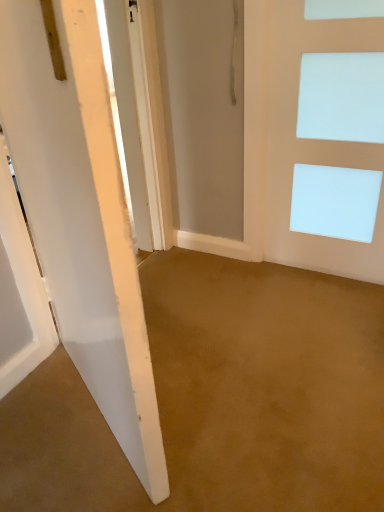
Question: From a real-world perspective, is white matte door at center, the 1th door from the left, located higher than white matte door at right, the second door viewed from the left?

Choices:
 (A) yes
 (B) no

Answer: (A)

Question: Is white matte door at center, the 1th door from the left, next to white matte door at right, the second door viewed from the left, and touching it?

Choices:
 (A) no
 (B) yes

Answer: (A)

Question: Is white matte door at center, the second door when ordered from right to left, smaller than white matte door at right, which is the 1th door from right to left?

Choices:
 (A) yes
 (B) no

Answer: (B)

Question: Is white matte door at center, the second door when ordered from right to left, oriented towards white matte door at right, which is the 1th door from right to left?

Choices:
 (A) yes
 (B) no

Answer: (A)

Question: Is white matte door at center, the 1th door from the left, positioned in front of white matte door at right, which is the 1th door from right to left?

Choices:
 (A) no
 (B) yes

Answer: (B)

Question: Can you confirm if white matte door at center, the second door when ordered from right to left, is thinner than white matte door at right, which is the 1th door from right to left?

Choices:
 (A) no
 (B) yes

Answer: (A)

Question: Is white matte door at right, which is the 1th door from right to left, thinner than white matte door at center, the second door when ordered from right to left?

Choices:
 (A) yes
 (B) no

Answer: (A)

Question: Would you consider white matte door at right, the second door viewed from the left, to be distant from white matte door at center, the 1th door from the left?

Choices:
 (A) yes
 (B) no

Answer: (A)

Question: Does white matte door at right, which is the 1th door from right to left, have a larger size compared to white matte door at center, the 1th door from the left?

Choices:
 (A) no
 (B) yes

Answer: (A)

Question: From the image's perspective, is white matte door at right, which is the 1th door from right to left, on white matte door at center, the second door when ordered from right to left?

Choices:
 (A) no
 (B) yes

Answer: (B)

Question: Considering the relative sizes of white matte door at right, the second door viewed from the left, and white matte door at center, the 1th door from the left, in the image provided, is white matte door at right, the second door viewed from the left, taller than white matte door at center, the 1th door from the left,?

Choices:
 (A) no
 (B) yes

Answer: (A)

Question: Is white matte door at right, which is the 1th door from right to left, further to the viewer compared to white matte door at center, the second door when ordered from right to left?

Choices:
 (A) yes
 (B) no

Answer: (A)

Question: Looking at the image, does white matte door at center, the 1th door from the left, seem bigger or smaller compared to white matte door at right, the second door viewed from the left?

Choices:
 (A) small
 (B) big

Answer: (B)